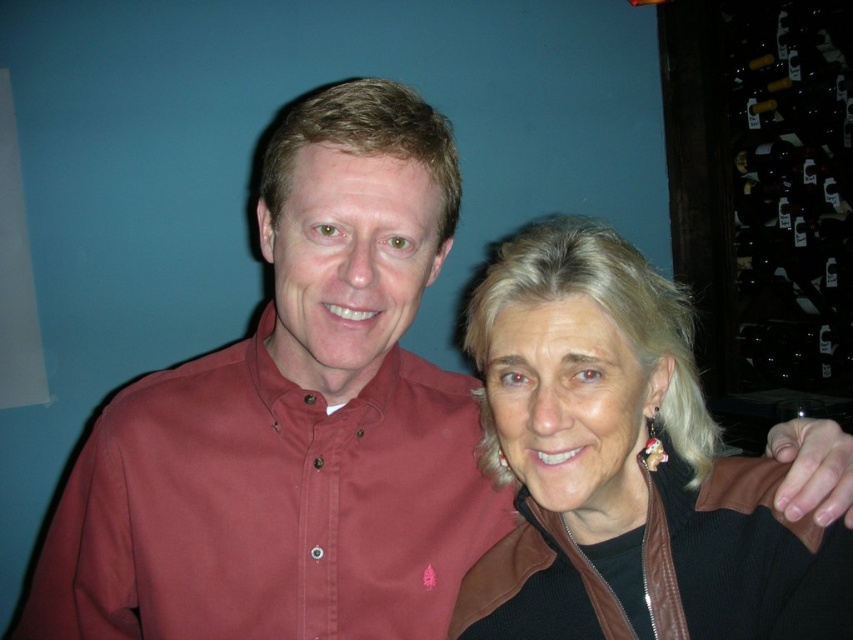
Question: Which of the following is the farthest from the observer?

Choices:
 (A) black leather jacket at upper right
 (B) burgundy cotton shirt at center

Answer: (B)

Question: From the image, what is the correct spatial relationship of burgundy cotton shirt at center in relation to black leather jacket at upper right?

Choices:
 (A) left
 (B) right

Answer: (A)

Question: Can you confirm if burgundy cotton shirt at center is bigger than black leather jacket at upper right?

Choices:
 (A) yes
 (B) no

Answer: (B)

Question: Which object appears farthest from the camera in this image?

Choices:
 (A) black leather jacket at upper right
 (B) burgundy cotton shirt at center

Answer: (B)

Question: Which point is closer to the camera?

Choices:
 (A) (633, 332)
 (B) (131, 627)

Answer: (A)

Question: Observing the image, what is the correct spatial positioning of burgundy cotton shirt at center in reference to black leather jacket at upper right?

Choices:
 (A) below
 (B) above

Answer: (A)